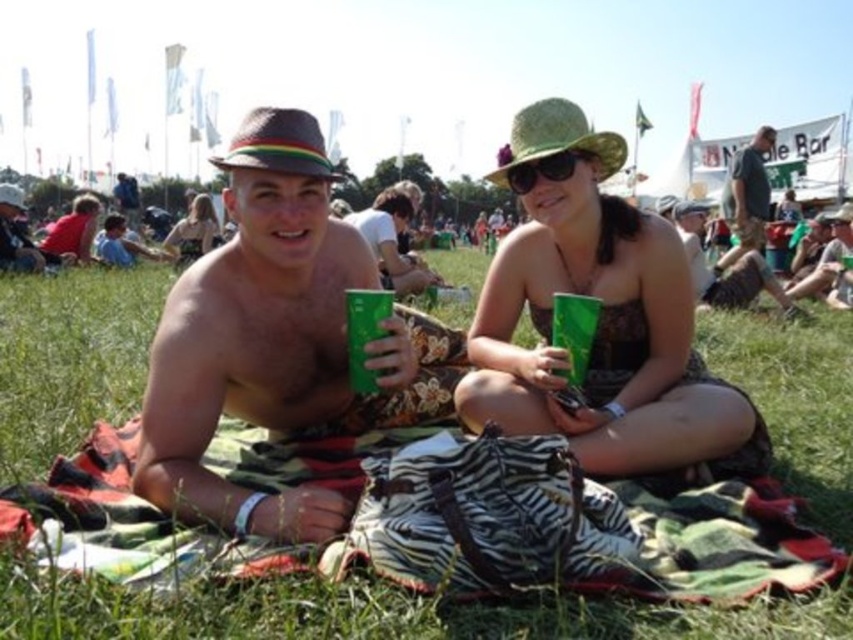
This screenshot has height=640, width=853. What do you see at coordinates (544, 170) in the screenshot? I see `green matte sunglasses at center` at bounding box center [544, 170].

Which of these two, green matte sunglasses at center or matte brown hat at upper left, stands shorter?

Standing shorter between the two is green matte sunglasses at center.

Between point (532, 179) and point (135, 212), which one is positioned in front?

Point (532, 179) is more forward.

Identify the location of green matte sunglasses at center. This screenshot has width=853, height=640. (544, 170).

Can you confirm if green grass at center is positioned to the left of matte brown hat at center?

Indeed, green grass at center is positioned on the left side of matte brown hat at center.

Can you confirm if green grass at center is taller than matte brown hat at center?

Indeed, green grass at center has a greater height compared to matte brown hat at center.

Is point (45, 616) more distant than point (253, 419)?

No, it is in front of (253, 419).

Find the location of a particular element. This screenshot has width=853, height=640. green grass at center is located at coordinates (375, 612).

Which is more to the left, green grass at center or red matte shirt at left?

Positioned to the left is red matte shirt at left.

Between green grass at center and red matte shirt at left, which one has less height?

green grass at center is shorter.

Find the location of a particular element. The width and height of the screenshot is (853, 640). green grass at center is located at coordinates (375, 612).